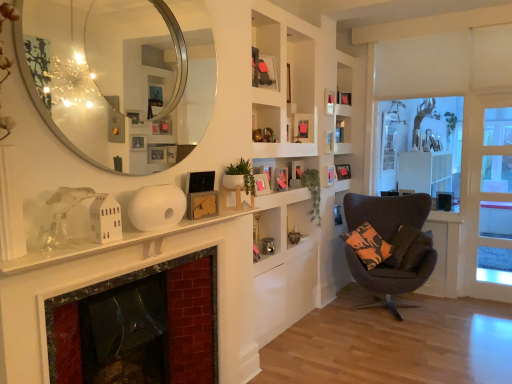
Question: Is wooden picture frame at upper center, placed as the fifth picture frame when sorted from front to back, taller or shorter than wooden picture frame at upper center, which appears as the sixth picture frame when viewed from the back?

Choices:
 (A) tall
 (B) short

Answer: (B)

Question: Is wooden picture frame at upper center, placed as the fifth picture frame when sorted from front to back, inside the boundaries of wooden picture frame at upper center, the 4th picture frame viewed from the front, or outside?

Choices:
 (A) inside
 (B) outside

Answer: (B)

Question: Estimate the real-world distances between objects in this image. Which object is farther from the wooden picture frame at center, which appears as the 3th picture frame when viewed from the left?

Choices:
 (A) white wood window frame at right
 (B) white matte fireplace mantle at center
 (C) wooden picture frame at upper center, placed as the 5th picture frame when sorted from left to right
 (D) wooden picture frame at upper center, placed as the fifth picture frame when sorted from front to back
 (E) wooden picture frame at upper center, the 4th picture frame viewed from the front

Answer: (A)

Question: Estimate the real-world distances between objects in this image. Which object is closer to the orange-patterned fabric pillow at lower right?

Choices:
 (A) green matte plant at center, the second plant from the back
 (B) white wood window frame at right
 (C) wooden picture frame at upper center, the 7th picture frame positioned from the left
 (D) wooden picture frame at upper center, positioned as the fifth picture frame in right-to-left order
 (E) wooden picture frame at upper center, placed as the fifth picture frame when sorted from front to back

Answer: (B)